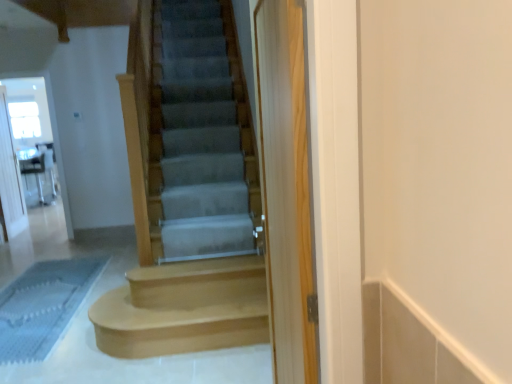
The height and width of the screenshot is (384, 512). Find the location of `vacant region under blue textured bath mat at lower left (from a real-world perspective)`. vacant region under blue textured bath mat at lower left (from a real-world perspective) is located at coordinates (45, 292).